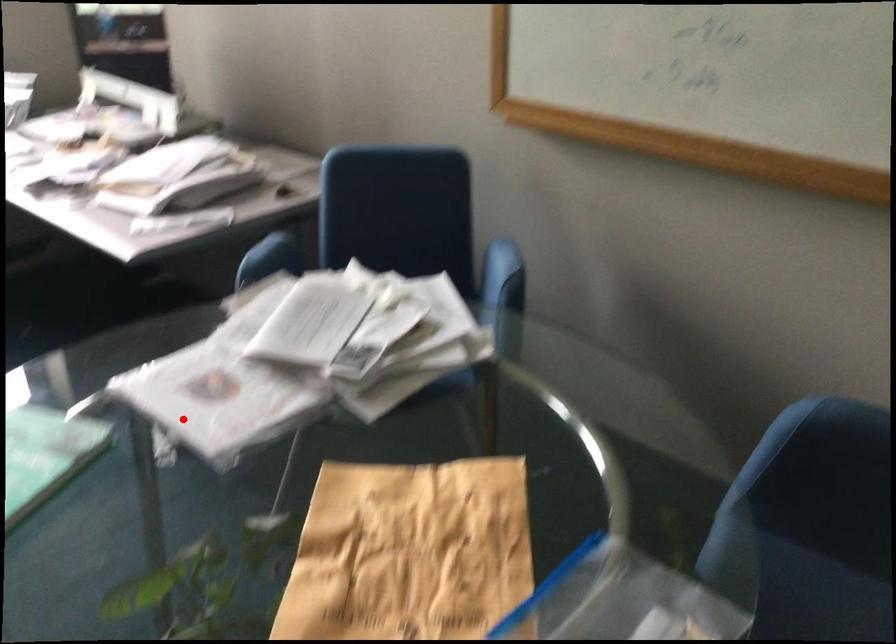
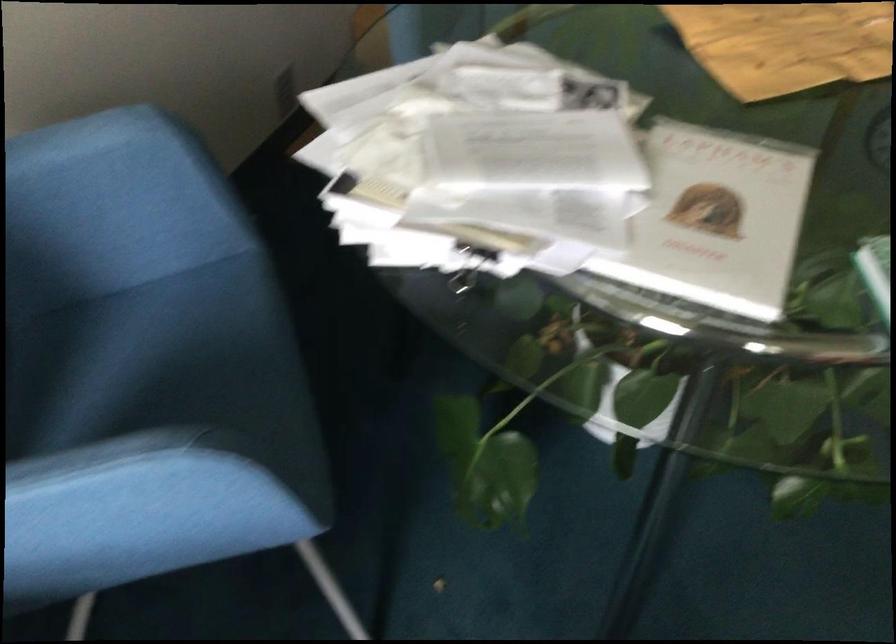
In the second image, find the point that corresponds to the highlighted location in the first image.

(716, 220)